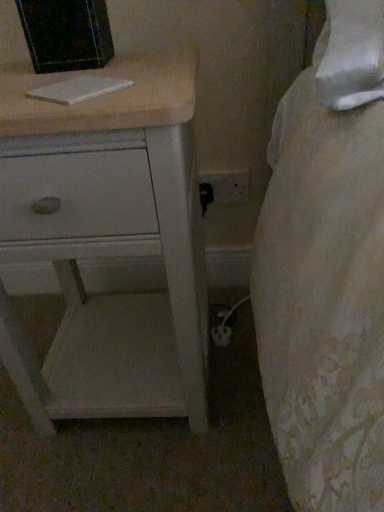
Question: Is point (195, 342) closer or farther from the camera than point (72, 101)?

Choices:
 (A) farther
 (B) closer

Answer: (A)

Question: Considering their positions, is white painted wood chest of drawers at left located in front of or behind white matte book at upper left?

Choices:
 (A) behind
 (B) front

Answer: (B)

Question: Is white painted wood chest of drawers at left situated inside white matte book at upper left or outside?

Choices:
 (A) outside
 (B) inside

Answer: (A)

Question: From the image's perspective, is white matte book at upper left positioned above or below white painted wood chest of drawers at left?

Choices:
 (A) above
 (B) below

Answer: (A)

Question: Considering the positions of white matte book at upper left and white painted wood chest of drawers at left in the image, is white matte book at upper left bigger or smaller than white painted wood chest of drawers at left?

Choices:
 (A) big
 (B) small

Answer: (B)

Question: Choose the correct answer: Is white matte book at upper left inside white painted wood chest of drawers at left or outside it?

Choices:
 (A) inside
 (B) outside

Answer: (A)

Question: In terms of height, does white matte book at upper left look taller or shorter compared to white painted wood chest of drawers at left?

Choices:
 (A) short
 (B) tall

Answer: (A)